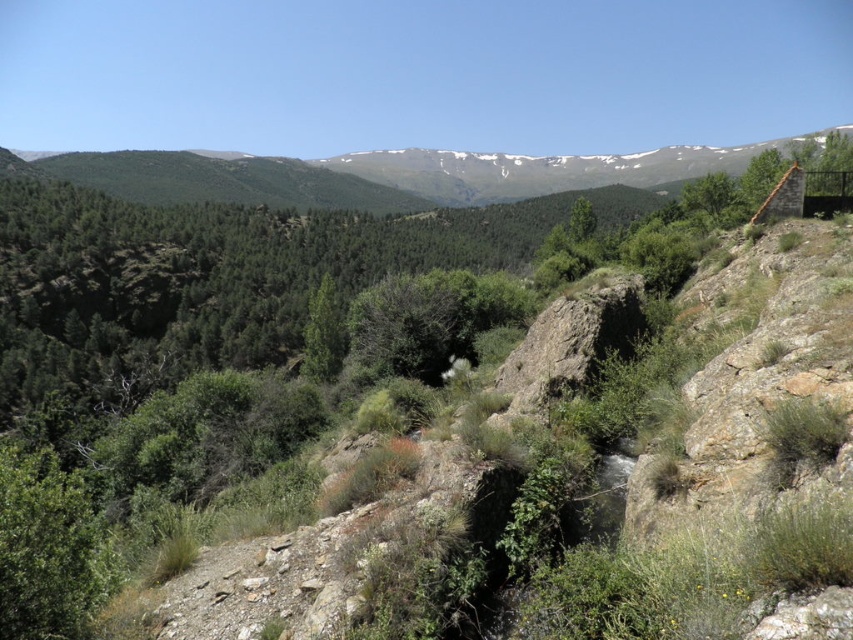
In the scene shown: You are standing at the base of the rocky slope in the image. Looking towards the green forested mountain at upper center, which direction should you head to reach it?

The green forested mountain at upper center is located at coordinates point 0.272 on the x axis and 0.456 on the y axis, so you should head towards the upper center direction to reach it.

You are a hiker standing at the base of the green rough bark tree at upper right. You want to reach the green forested mountain at upper center. Which direction should you head to ascend towards it?

The green forested mountain at upper center is above the green rough bark tree at upper right, so you should head towards the upper direction from the green rough bark tree at upper right to ascend towards the green forested mountain at upper center.

You are a hiker standing at the base of the green forested mountain at upper center and the green rough bark tree at upper right. Which one do you need to look up more to see the top of?

You need to look up more to see the top of the green forested mountain at upper center because it is taller than the green rough bark tree at upper right.